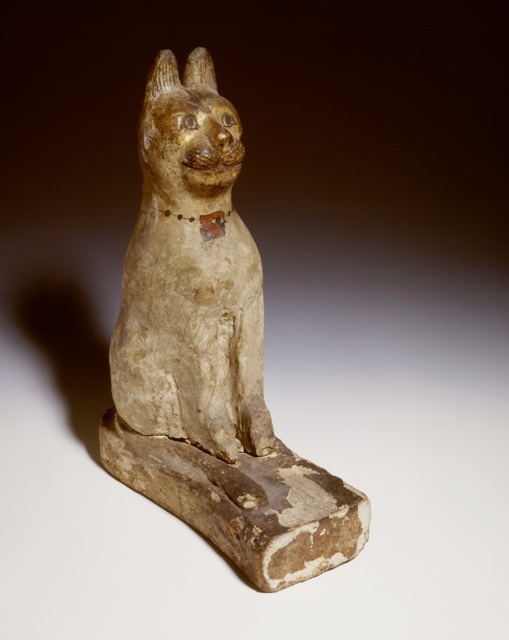
Question: Is matte beige cat statue at center bigger than matte beige cat at center?

Choices:
 (A) yes
 (B) no

Answer: (A)

Question: Observing the image, what is the correct spatial positioning of matte beige cat statue at center in reference to matte beige cat at center?

Choices:
 (A) left
 (B) right

Answer: (A)

Question: Which object is farther from the camera taking this photo?

Choices:
 (A) matte beige cat statue at center
 (B) matte beige cat at center

Answer: (B)

Question: Is matte beige cat statue at center smaller than matte beige cat at center?

Choices:
 (A) no
 (B) yes

Answer: (A)

Question: Which of the following is the farthest from the observer?

Choices:
 (A) matte beige cat statue at center
 (B) matte beige cat at center

Answer: (B)